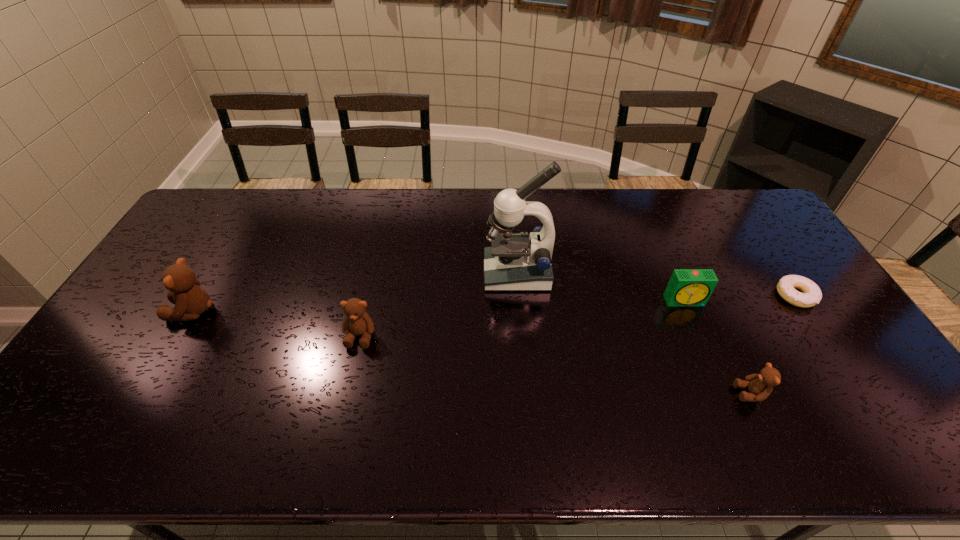
Identify the location of vacant area that lies between the alarm clock and the fifth object from right to left. This screenshot has width=960, height=540. (522, 318).

Identify the location of empty space that is in between the shortest teddy bear and the second object from left to right. This screenshot has height=540, width=960. (556, 364).

Locate an element on the screen. The height and width of the screenshot is (540, 960). vacant area that lies between the rightmost object and the shortest teddy bear is located at coordinates (773, 345).

This screenshot has height=540, width=960. In order to click on blank region between the shortest object and the second object from left to right in this screenshot , I will do `click(578, 315)`.

Identify the location of free space that is in between the tallest teddy bear and the shortest teddy bear. The image size is (960, 540). (472, 352).

Identify the location of unoccupied position between the tallest teddy bear and the second teddy bear from left to right. The height and width of the screenshot is (540, 960). (276, 323).

At what (x,y) coordinates should I click in order to perform the action: click on unoccupied position between the leftmost teddy bear and the rightmost teddy bear. Please return your answer as a coordinate pair (x, y). The width and height of the screenshot is (960, 540). Looking at the image, I should click on (472, 352).

This screenshot has width=960, height=540. Find the location of `object that ranks as the fifth closest to the alarm clock`. object that ranks as the fifth closest to the alarm clock is located at coordinates click(191, 300).

The width and height of the screenshot is (960, 540). What are the coordinates of `object that stands as the fifth closest to the rightmost object` in the screenshot? It's located at (191, 300).

Select which teddy bear appears as the closest to the alarm clock. Please provide its 2D coordinates. Your answer should be formatted as a tuple, i.e. [(x, y)], where the tuple contains the x and y coordinates of a point satisfying the conditions above.

[(760, 386)]